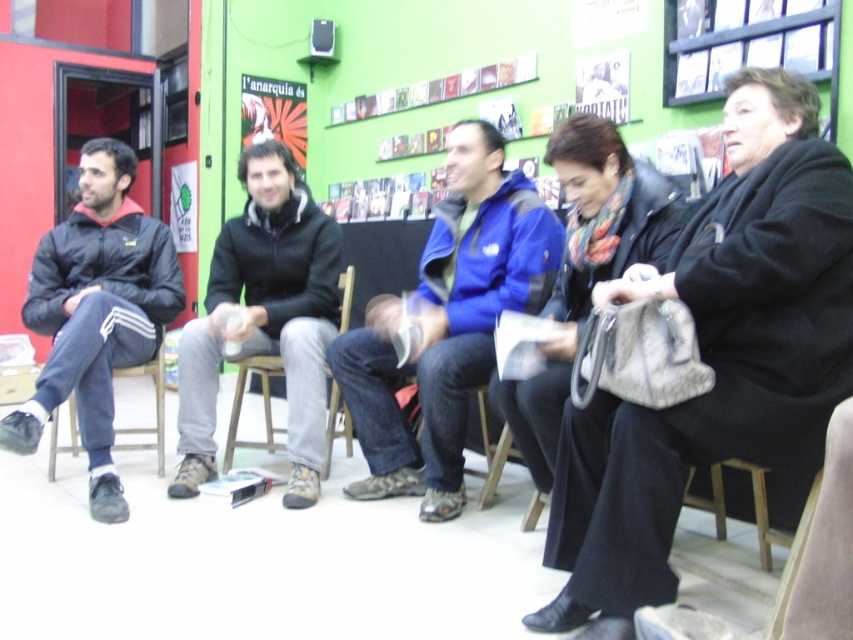
You are organizing a photo shoot and need to ensure that the blue fleece jacket at center can be clearly seen in the frame. Given that the wooden chair at center is already in the shot, how should you adjust the camera angle to accommodate both objects?

Since the blue fleece jacket at center is smaller than the wooden chair at center, you should position the camera closer to the blue fleece jacket at center to ensure it is visible alongside the larger wooden chair at center in the frame.

You are organizing a photo shoot and need to adjust the seating arrangement so that the matte black jacket at left and the blue fleece jacket at center are both visible in the frame. Given their current positions, which jacket is blocking the view of the other?

The matte black jacket at left is behind the blue fleece jacket at center, so the blue fleece jacket at center is blocking the view of the matte black jacket at left.